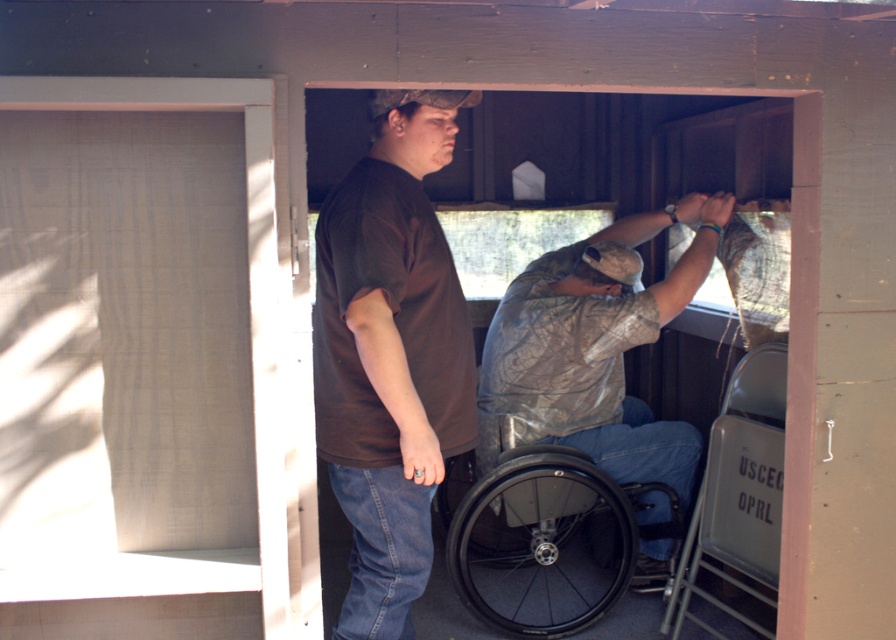
Question: Does brown matte shirt at center have a lesser width compared to camouflage fabric shirt at center?

Choices:
 (A) no
 (B) yes

Answer: (B)

Question: Does brown matte shirt at center appear over camouflage fabric shirt at center?

Choices:
 (A) no
 (B) yes

Answer: (A)

Question: Which of these objects is positioned closest to the black rubber wheelchair at lower center?

Choices:
 (A) brown matte shirt at center
 (B) camouflage fabric shirt at center

Answer: (B)

Question: Which point appears farthest from the camera in this image?

Choices:
 (A) (613, 433)
 (B) (332, 349)
 (C) (773, 545)

Answer: (A)

Question: Which point is farther to the camera?

Choices:
 (A) (371, 582)
 (B) (653, 332)

Answer: (B)

Question: Is brown matte shirt at center below camouflage fabric shirt at center?

Choices:
 (A) yes
 (B) no

Answer: (A)